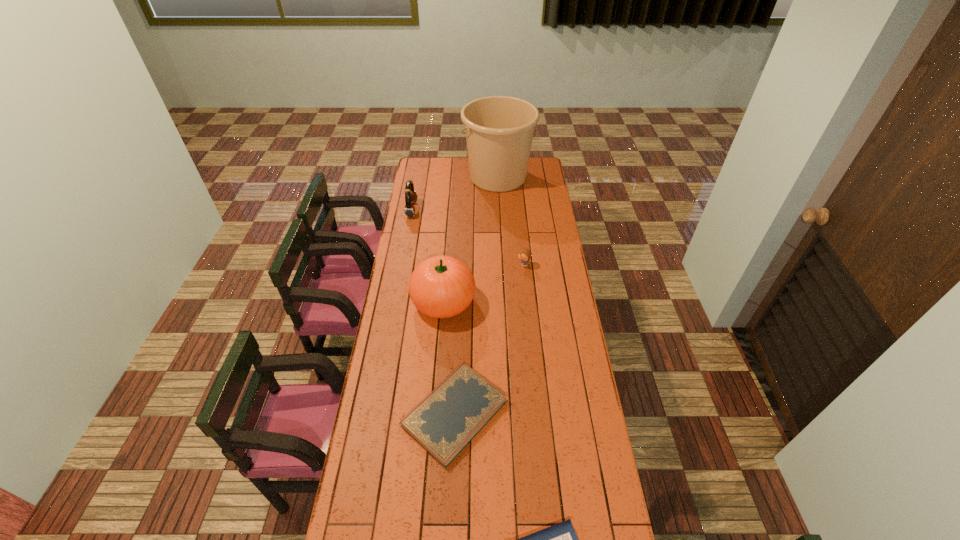
You are a GUI agent. You are given a task and a screenshot of the screen. Output one action in this format:
    pyautogui.click(x=<x>, y=<y>)
    Task: Click on the paperback book at the left edge
    This screenshot has height=540, width=960.
    Given the screenshot: What is the action you would take?
    (x=443, y=423)

The image size is (960, 540). What are the coordinates of `object positioned at the right edge` in the screenshot? It's located at (499, 130).

This screenshot has width=960, height=540. What are the coordinates of `object situated at the far right corner` in the screenshot? It's located at (499, 130).

Locate an element on the screen. This screenshot has height=540, width=960. vacant space at the left edge of the desktop is located at coordinates point(354,481).

This screenshot has width=960, height=540. Identify the location of free space at the right edge of the desktop. (555, 220).

You are a GUI agent. You are given a task and a screenshot of the screen. Output one action in this format:
    pyautogui.click(x=<x>, y=<y>)
    Task: Click on the free space between the tallest object and the pumpkin
    Image resolution: width=960 pixels, height=540 pixels.
    Given the screenshot: What is the action you would take?
    pyautogui.click(x=470, y=239)

The height and width of the screenshot is (540, 960). I want to click on blank region between the second tallest object and the fourth nearest object, so click(x=483, y=283).

At what (x,y) coordinates should I click in order to perform the action: click on free space that is in between the fourth farthest object and the third farthest object. Please return your answer as a coordinate pair (x, y). Looking at the image, I should click on (483, 283).

The image size is (960, 540). What are the coordinates of `unoccupied position between the farthest object and the headset` in the screenshot? It's located at (455, 193).

Identify the location of empty location between the farthest object and the leftmost object. (x=455, y=193).